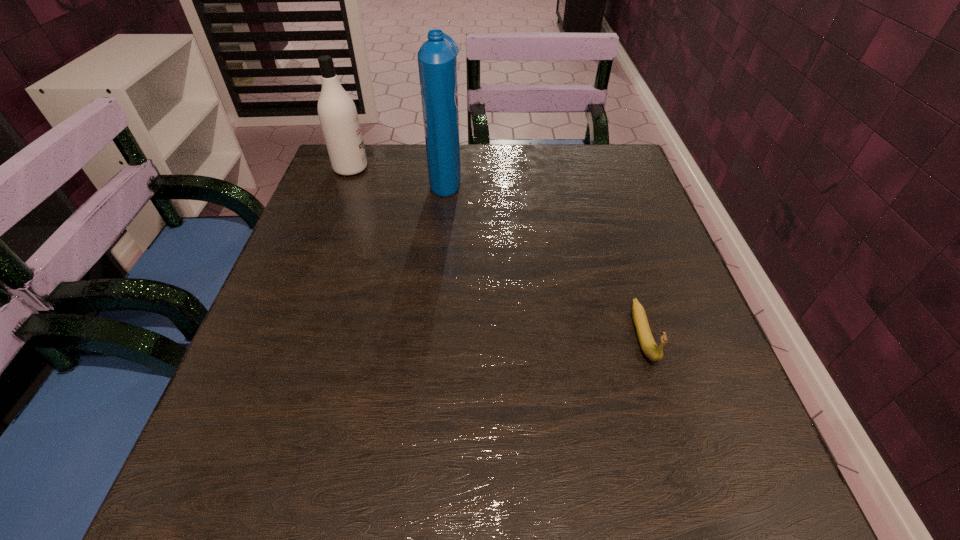
This screenshot has height=540, width=960. I want to click on vacant area that satisfies the following two spatial constraints: 1. on the front-facing side of the second object from left to right; 2. on the left side of the leftmost object, so click(x=348, y=174).

I want to click on free space that satisfies the following two spatial constraints: 1. on the front-facing side of the tallest object; 2. on the right side of the left shampoo, so click(348, 174).

Image resolution: width=960 pixels, height=540 pixels. What are the coordinates of `vacant region that satisfies the following two spatial constraints: 1. on the back side of the second object from left to right; 2. on the front-facing side of the left shampoo` in the screenshot? It's located at (447, 168).

You are a GUI agent. You are given a task and a screenshot of the screen. Output one action in this format:
    pyautogui.click(x=<x>, y=<y>)
    Task: Click on the free point that satisfies the following two spatial constraints: 1. on the front-facing side of the left shampoo; 2. on the left side of the right shampoo
    The image size is (960, 540).
    Given the screenshot: What is the action you would take?
    pyautogui.click(x=348, y=174)

Identify the location of free space that satisfies the following two spatial constraints: 1. on the front-facing side of the second object from right to left; 2. on the right side of the shorter shampoo. Image resolution: width=960 pixels, height=540 pixels. (348, 174).

Image resolution: width=960 pixels, height=540 pixels. Find the location of `vacant position in the image that satisfies the following two spatial constraints: 1. on the front-facing side of the second object from left to right; 2. on the left side of the second shortest object`. vacant position in the image that satisfies the following two spatial constraints: 1. on the front-facing side of the second object from left to right; 2. on the left side of the second shortest object is located at coordinates (348, 174).

The height and width of the screenshot is (540, 960). In order to click on vacant point that satisfies the following two spatial constraints: 1. on the front-facing side of the shorter shampoo; 2. on the right side of the taller shampoo in this screenshot , I will do `click(348, 174)`.

You are a GUI agent. You are given a task and a screenshot of the screen. Output one action in this format:
    pyautogui.click(x=<x>, y=<y>)
    Task: Click on the vacant region that satisfies the following two spatial constraints: 1. on the front-facing side of the leftmost object; 2. on the left side of the taller shampoo
    This screenshot has height=540, width=960.
    Given the screenshot: What is the action you would take?
    pyautogui.click(x=348, y=174)